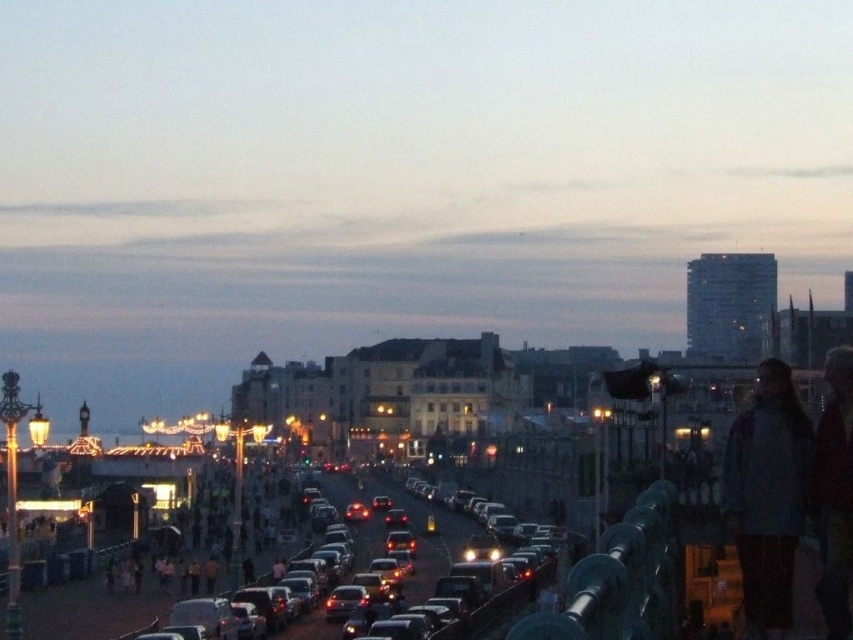
You are standing on a balcony overlooking the city. You see a light gray sweater at right and a shiny silver car at center. Which object is positioned to the right side of the other?

The light gray sweater at right is positioned to the right of the shiny silver car at center.

You are standing at the railing and want to walk towards the point labeled as point (x=425, y=573). Which direction should you move relative to point (x=781, y=584)?

Since point (x=781, y=584) is in front of point (x=425, y=573), you should move backward from point (x=781, y=584) to reach point (x=425, y=573).

You are a photographer standing at the edge of the railing and want to capture both the light gray sweater at right and the shiny silver car at center in your shot. Which object should you focus on first if you want to ensure both are in clear focus?

The light gray sweater at right is taller than the shiny silver car at center, so focusing on the taller object first would help ensure both are in clear focus.